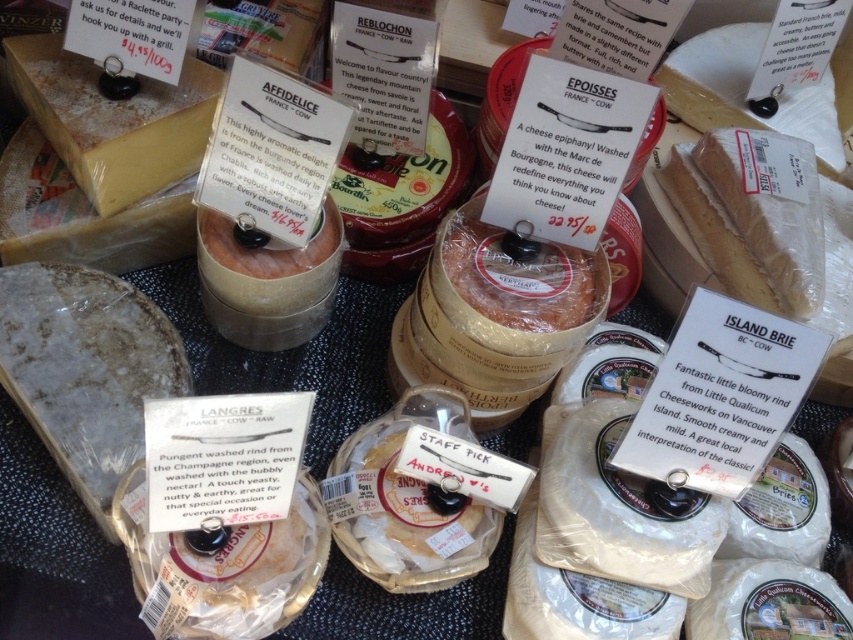
Question: Is yellowish hard cheese at upper left below white crumbly cheese at upper right?

Choices:
 (A) yes
 (B) no

Answer: (A)

Question: Among these objects, which one is nearest to the camera?

Choices:
 (A) white crumbly cheese at upper right
 (B) yellowish hard cheese at upper left

Answer: (B)

Question: Does yellowish hard cheese at upper left have a lesser width compared to white crumbly cheese at upper right?

Choices:
 (A) yes
 (B) no

Answer: (A)

Question: Can you confirm if yellowish hard cheese at upper left is positioned below white crumbly cheese at upper right?

Choices:
 (A) yes
 (B) no

Answer: (A)